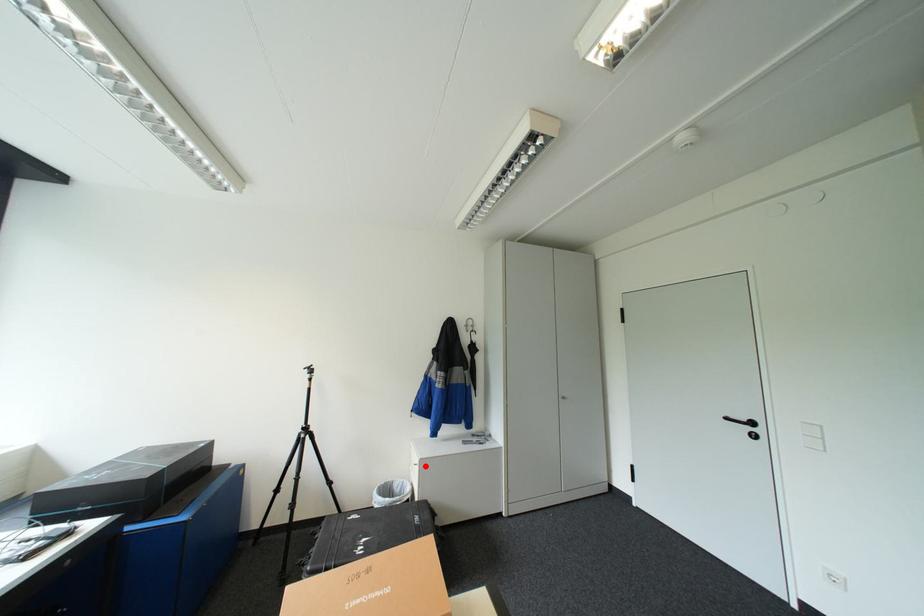
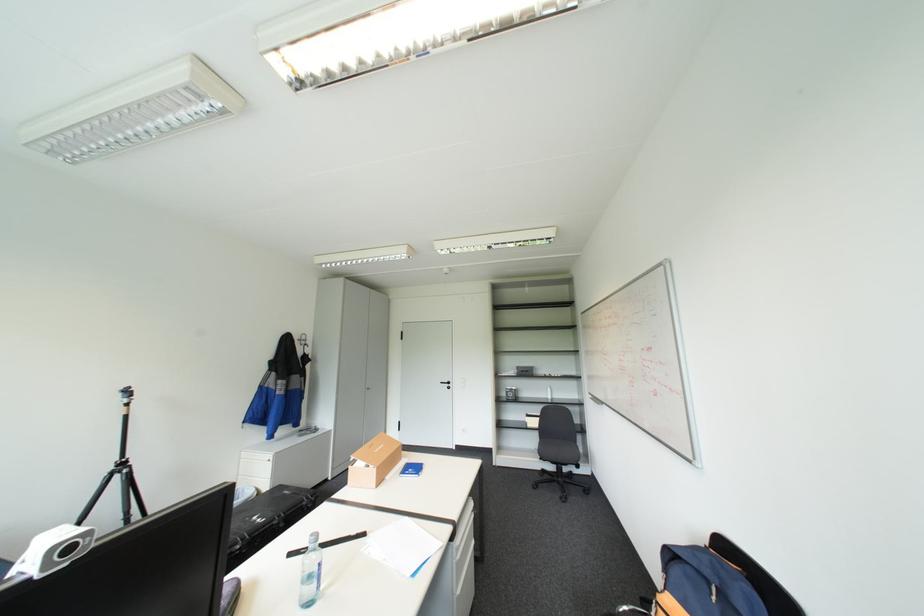
Question: I am providing you with two images of the same scene from different viewpoints. A red point is marked on the first image. At the location where the point appears in image 1, is it still visible in image 2?

Choices:
 (A) Yes
 (B) No

Answer: (A)